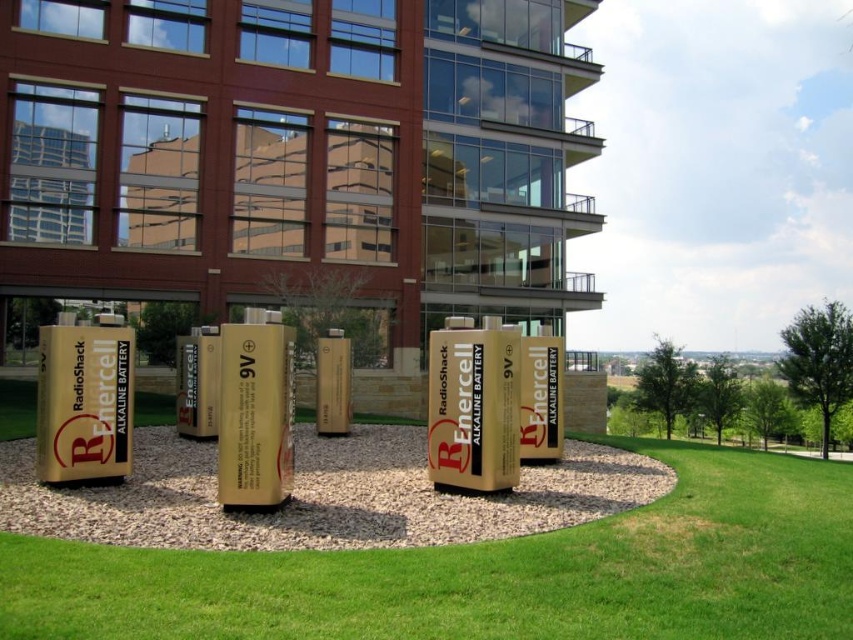
Is point (425, 561) farther from viewer compared to point (189, 541)?

No, (425, 561) is in front of (189, 541).

Is green grass at center positioned before gold gravel at center?

Yes, it is in front of gold gravel at center.

Find the location of a particular element. This screenshot has height=640, width=853. green grass at center is located at coordinates (492, 572).

The width and height of the screenshot is (853, 640). Identify the location of green grass at center. (492, 572).